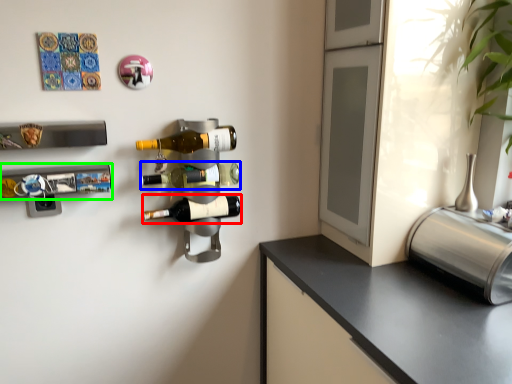
Question: Considering the real-world distances, which object is closest to beer bottle (highlighted by a red box)? beer bottle (highlighted by a blue box) or wine rack (highlighted by a green box).

Choices:
 (A) beer bottle
 (B) wine rack

Answer: (A)